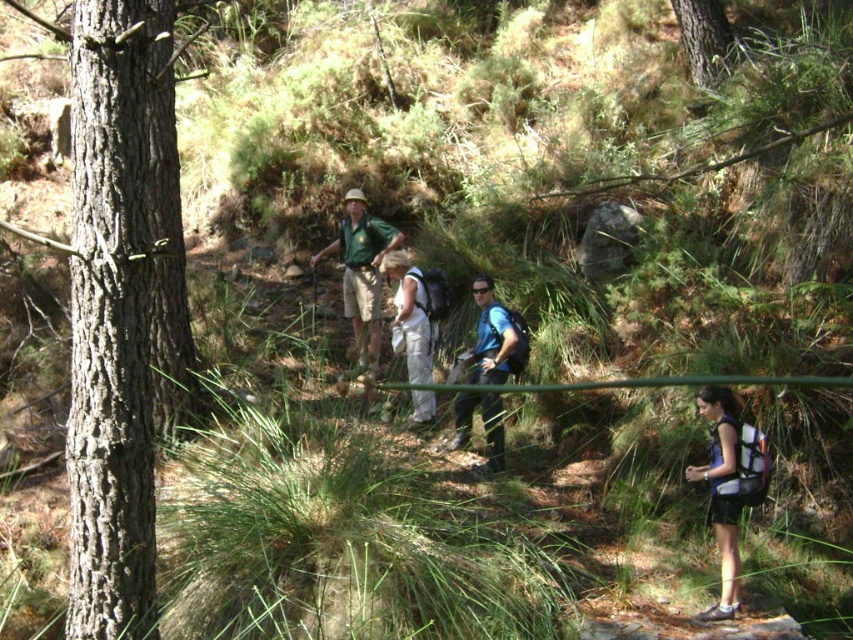
You are a hiker trying to locate the gray rough bark tree at left. From your current position at the white fabric pants at center, in which direction should you look to see it?

The gray rough bark tree at left is to the left of the white fabric pants at center, so you should look to your left to see it.